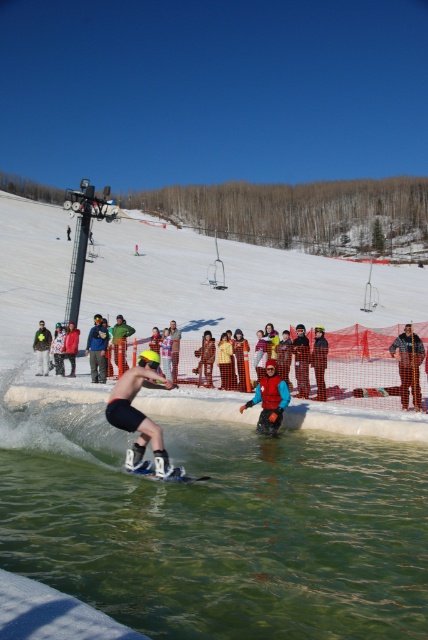
Does clear water at center come behind blue plastic snowboard at center?

No, it is in front of blue plastic snowboard at center.

Who is more distant from viewer, (383, 468) or (146, 472)?

The point (383, 468) is behind.

Is point (21, 500) behind point (136, 468)?

No, it is not.

At what (x,y) coordinates should I click in order to perform the action: click on clear water at center. Please return your answer as a coordinate pair (x, y). This screenshot has height=640, width=428. Looking at the image, I should click on (219, 528).

Which is above, blue plastic snowboard at center or red fabric jacket at center?

red fabric jacket at center is higher up.

Between blue plastic snowboard at center and red fabric jacket at center, which one has less height?

blue plastic snowboard at center is shorter.

You are a GUI agent. You are given a task and a screenshot of the screen. Output one action in this format:
    pyautogui.click(x=<x>, y=<y>)
    Task: Click on the blue plastic snowboard at center
    This screenshot has width=428, height=640.
    Given the screenshot: What is the action you would take?
    pyautogui.click(x=166, y=476)

You are a GUI agent. You are given a task and a screenshot of the screen. Output one action in this format:
    pyautogui.click(x=<x>, y=<y>)
    Task: Click on the blue plastic snowboard at center
    
    Given the screenshot: What is the action you would take?
    pyautogui.click(x=166, y=476)

Which is more to the left, clear water at center or blue fabric jacket at center?

blue fabric jacket at center

Does clear water at center have a greater width compared to blue fabric jacket at center?

Yes.

Who is more forward, [250,470] or [104,365]?

Point [250,470] is more forward.

This screenshot has height=640, width=428. I want to click on clear water at center, so click(219, 528).